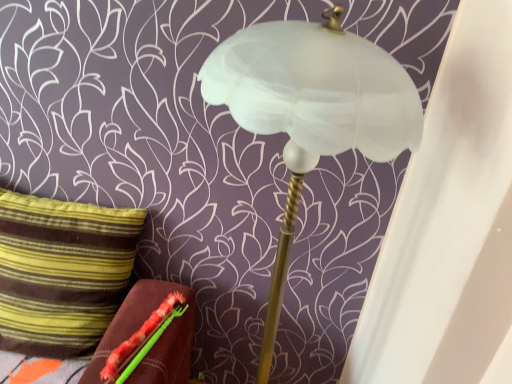
Question: From a real-world perspective, is white frosted glass lamp at center under striped fabric pillow at left?

Choices:
 (A) yes
 (B) no

Answer: (B)

Question: Is white frosted glass lamp at center aimed at striped fabric pillow at left?

Choices:
 (A) yes
 (B) no

Answer: (B)

Question: Is white frosted glass lamp at center closer to camera compared to striped fabric pillow at left?

Choices:
 (A) no
 (B) yes

Answer: (B)

Question: Is white frosted glass lamp at center positioned behind striped fabric pillow at left?

Choices:
 (A) yes
 (B) no

Answer: (B)

Question: Would you say white frosted glass lamp at center contains striped fabric pillow at left?

Choices:
 (A) yes
 (B) no

Answer: (B)

Question: In terms of size, does white frosted glass lamp at center appear bigger or smaller than green fuzzy brush at lower left?

Choices:
 (A) small
 (B) big

Answer: (B)

Question: In terms of height, does white frosted glass lamp at center look taller or shorter compared to green fuzzy brush at lower left?

Choices:
 (A) short
 (B) tall

Answer: (B)

Question: Based on their positions, is white frosted glass lamp at center located to the left or right of green fuzzy brush at lower left?

Choices:
 (A) right
 (B) left

Answer: (A)

Question: Do you think white frosted glass lamp at center is within green fuzzy brush at lower left, or outside of it?

Choices:
 (A) inside
 (B) outside

Answer: (B)

Question: Is white frosted glass lamp at center bigger or smaller than striped fabric pillow at left?

Choices:
 (A) small
 (B) big

Answer: (B)

Question: Considering the positions of white frosted glass lamp at center and striped fabric pillow at left in the image, is white frosted glass lamp at center wider or thinner than striped fabric pillow at left?

Choices:
 (A) wide
 (B) thin

Answer: (A)

Question: Is white frosted glass lamp at center in front of or behind striped fabric pillow at left in the image?

Choices:
 (A) front
 (B) behind

Answer: (A)

Question: Is point (293, 183) closer or farther from the camera than point (17, 236)?

Choices:
 (A) farther
 (B) closer

Answer: (B)

Question: Is point pyautogui.click(x=167, y=317) positioned closer to the camera than point pyautogui.click(x=311, y=31)?

Choices:
 (A) farther
 (B) closer

Answer: (A)

Question: In terms of height, does green fuzzy brush at lower left look taller or shorter compared to white frosted glass lamp at center?

Choices:
 (A) tall
 (B) short

Answer: (B)